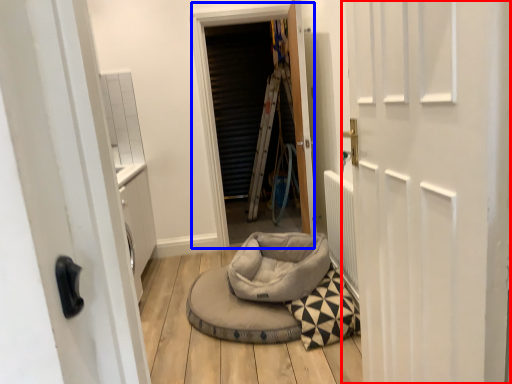
Question: Which object appears closest to the camera in this image, door (highlighted by a red box) or window screen (highlighted by a blue box)?

Choices:
 (A) door
 (B) window screen

Answer: (A)